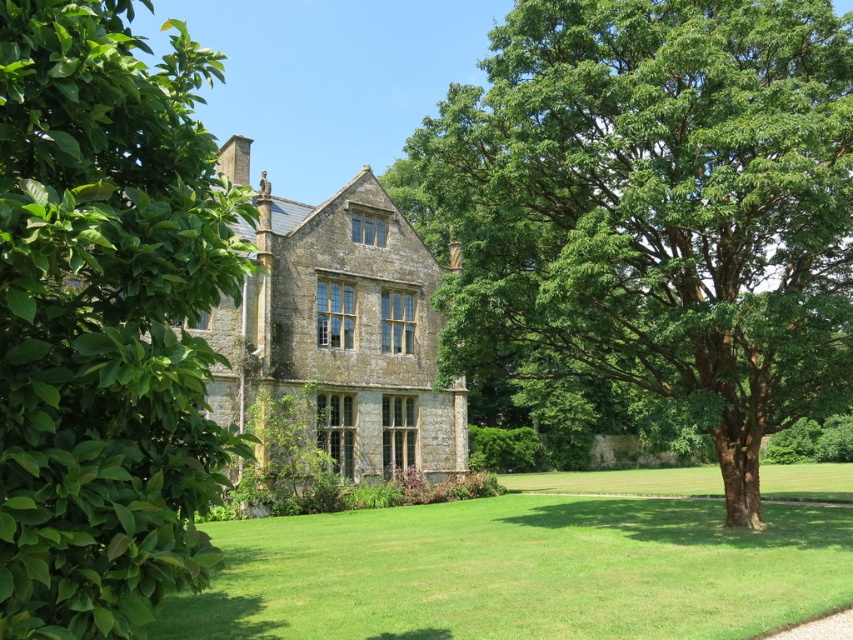
Does green leafy bush at left have a smaller size compared to green grass lawn at center?

Yes.

Between green leafy bush at left and green grass lawn at center, which one is positioned lower?

green grass lawn at center is below.

Does point (32, 100) come in front of point (281, 520)?

Yes, it is in front of point (281, 520).

The width and height of the screenshot is (853, 640). Identify the location of green leafy bush at left. (105, 320).

Does green leafy tree at right have a smaller size compared to green grass lawn at center?

Actually, green leafy tree at right might be larger than green grass lawn at center.

Is green leafy tree at right to the left of green grass lawn at center from the viewer's perspective?

Indeed, green leafy tree at right is positioned on the left side of green grass lawn at center.

Describe the element at coordinates (653, 209) in the screenshot. I see `green leafy tree at right` at that location.

Image resolution: width=853 pixels, height=640 pixels. In order to click on green leafy tree at right in this screenshot , I will do `click(653, 209)`.

Which of these two, green leafy tree at right or green leafy bush at left, stands taller?

green leafy tree at right

Does green leafy tree at right have a smaller size compared to green leafy bush at left?

Actually, green leafy tree at right might be larger than green leafy bush at left.

Locate an element on the screen. The image size is (853, 640). green leafy tree at right is located at coordinates pyautogui.click(x=653, y=209).